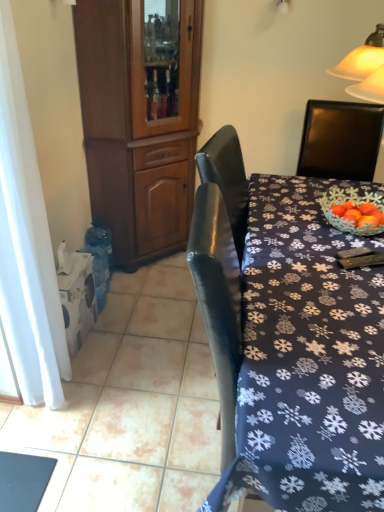
Where is `vacant area that lies to the right of white sheer curtain at left`? The width and height of the screenshot is (384, 512). vacant area that lies to the right of white sheer curtain at left is located at coordinates (110, 392).